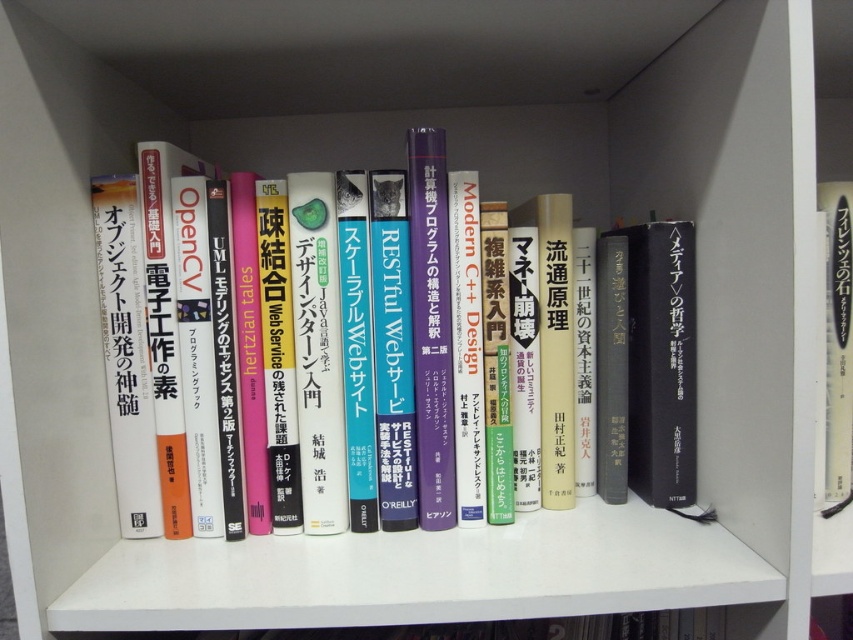
Question: Among these points, which one is nearest to the camera?

Choices:
 (A) (827, 492)
 (B) (155, 419)

Answer: (B)

Question: Is hardcover book at center to the right of white paper book at right from the viewer's perspective?

Choices:
 (A) no
 (B) yes

Answer: (A)

Question: From the image, what is the correct spatial relationship of hardcover book at center in relation to white paper book at right?

Choices:
 (A) above
 (B) below

Answer: (B)

Question: Which of the following is the farthest from the observer?

Choices:
 (A) (276, 280)
 (B) (840, 262)

Answer: (B)

Question: From the image, what is the correct spatial relationship of hardcover book at center in relation to white paper book at right?

Choices:
 (A) left
 (B) right

Answer: (A)